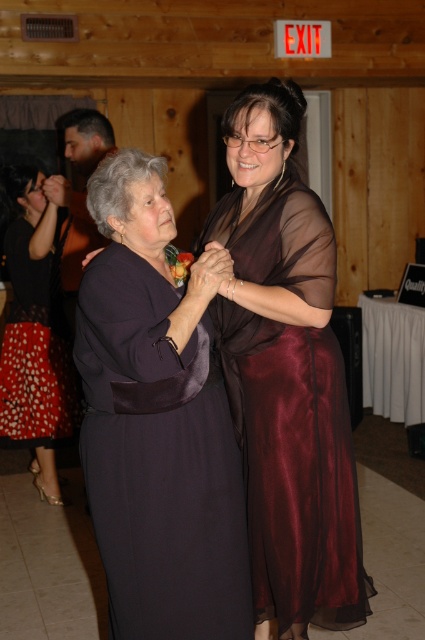
Can you confirm if dark satin dress at center is positioned to the left of red dotted fabric dress at lower left?

In fact, dark satin dress at center is to the right of red dotted fabric dress at lower left.

Does dark satin dress at center lie in front of red dotted fabric dress at lower left?

Result: Yes, it is in front of red dotted fabric dress at lower left.

Which is in front, point (217, 545) or point (25, 220)?

Point (217, 545) is in front.

Where is `dark satin dress at center`? dark satin dress at center is located at coordinates (158, 460).

Does burgundy satin dress at center appear over red dotted fabric dress at lower left?

Actually, burgundy satin dress at center is below red dotted fabric dress at lower left.

Is point (283, 275) behind point (25, 227)?

No.

You are a GUI agent. You are given a task and a screenshot of the screen. Output one action in this format:
    pyautogui.click(x=<x>, y=<y>)
    Task: Click on the burgundy satin dress at center
    
    Given the screenshot: What is the action you would take?
    pyautogui.click(x=294, y=467)

Is dark satin dress at center positioned at the back of burgundy satin dress at center?

No, it is not.

Who is more forward, [175,582] or [246,353]?

Point [175,582] is in front.

This screenshot has height=640, width=425. What do you see at coordinates (158, 460) in the screenshot?
I see `dark satin dress at center` at bounding box center [158, 460].

This screenshot has width=425, height=640. I want to click on dark satin dress at center, so click(x=158, y=460).